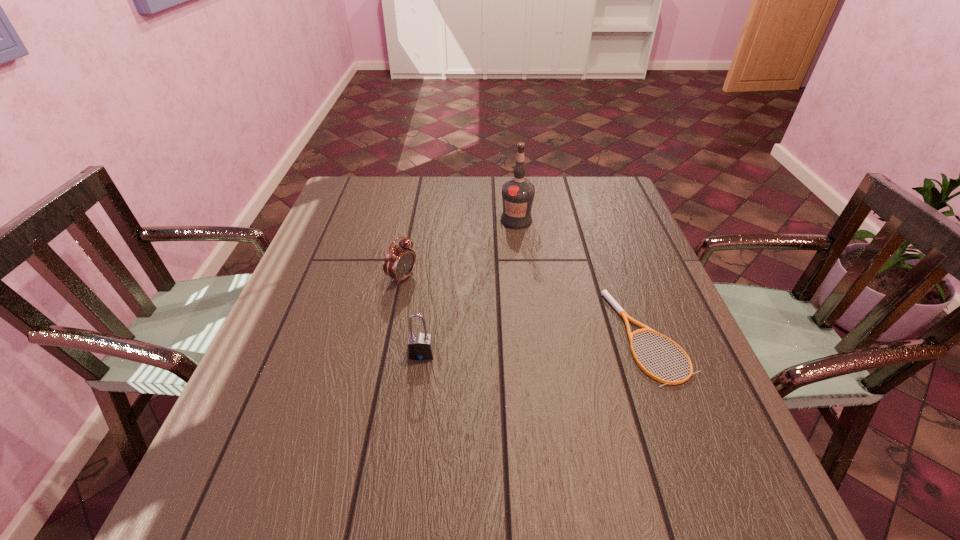
The height and width of the screenshot is (540, 960). I want to click on vacant area that lies between the rightmost object and the second object from left to right, so click(535, 345).

Locate an element on the screen. The image size is (960, 540). free space between the vodka and the padlock is located at coordinates (469, 287).

You are a GUI agent. You are given a task and a screenshot of the screen. Output one action in this format:
    pyautogui.click(x=<x>, y=<y>)
    Task: Click on the unoccupied position between the vodka and the tennis racket
    
    Given the screenshot: What is the action you would take?
    pyautogui.click(x=583, y=278)

You are a GUI agent. You are given a task and a screenshot of the screen. Output one action in this format:
    pyautogui.click(x=<x>, y=<y>)
    Task: Click on the third closest object to the vodka
    
    Given the screenshot: What is the action you would take?
    pyautogui.click(x=420, y=346)

Point out which object is positioned as the second nearest to the tennis racket. Please provide its 2D coordinates. Your answer should be formatted as a tuple, i.e. [(x, y)], where the tuple contains the x and y coordinates of a point satisfying the conditions above.

[(420, 346)]

Find the location of `vacant area in the image that satisfies the following two spatial constraints: 1. on the back side of the leftmost object; 2. on the left side of the farthest object`. vacant area in the image that satisfies the following two spatial constraints: 1. on the back side of the leftmost object; 2. on the left side of the farthest object is located at coordinates (414, 220).